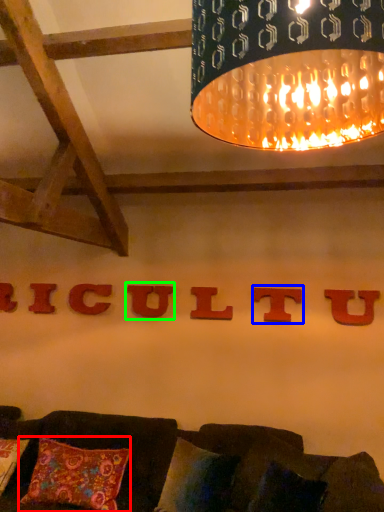
Question: Which object is the closest to the pillow (highlighted by a red box)? Choose among these: alphabet (highlighted by a blue box) or alphabet (highlighted by a green box).

Choices:
 (A) alphabet
 (B) alphabet

Answer: (B)